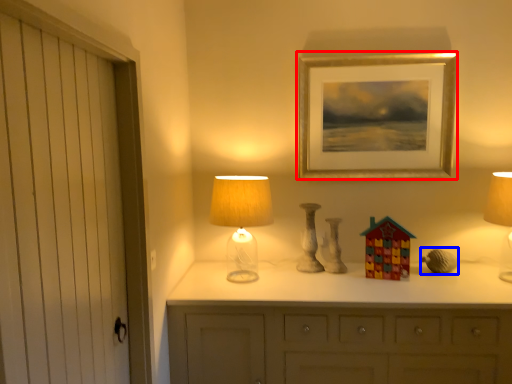
Question: Which point is closer to the camera, picture frame (highlighted by a red box) or miniature (highlighted by a blue box)?

Choices:
 (A) picture frame
 (B) miniature

Answer: (B)